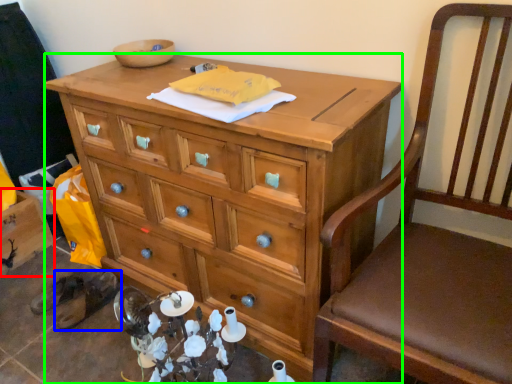
Question: Considering the real-world distances, which object is farthest from cabinetry (highlighted by a red box)? footwear (highlighted by a blue box) or desk (highlighted by a green box)?

Choices:
 (A) footwear
 (B) desk

Answer: (B)